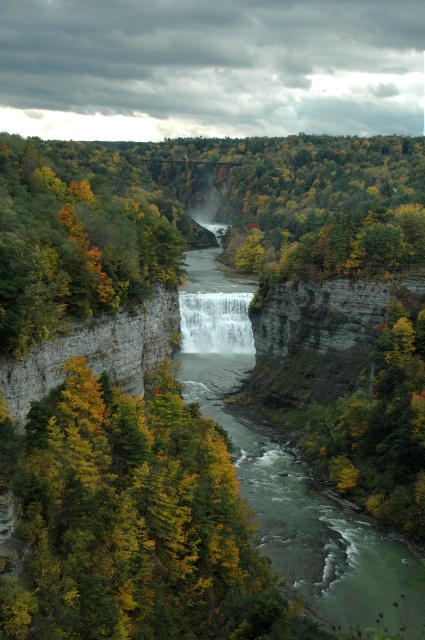
Question: Is green smooth river at center thinner than green leafy tree at right?

Choices:
 (A) yes
 (B) no

Answer: (B)

Question: Which object appears closest to the camera in this image?

Choices:
 (A) green leafy tree at left
 (B) green smooth river at center

Answer: (A)

Question: Does green leafy tree at left appear on the right side of green leafy tree at right?

Choices:
 (A) yes
 (B) no

Answer: (B)

Question: Does green smooth river at center lie in front of white frothy water at center?

Choices:
 (A) no
 (B) yes

Answer: (B)

Question: Which object is farther from the camera taking this photo?

Choices:
 (A) green leafy tree at right
 (B) gray rocky cliff at center
 (C) white frothy water at center

Answer: (C)

Question: Which point is farther to the camera?

Choices:
 (A) (226, 308)
 (B) (28, 260)
 (C) (391, 378)

Answer: (A)